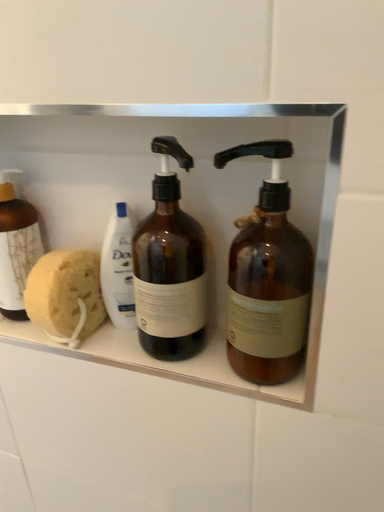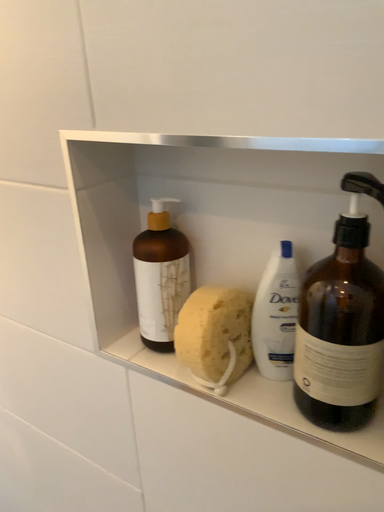
Question: Which way did the camera rotate in the video?

Choices:
 (A) rotated right
 (B) rotated left

Answer: (B)